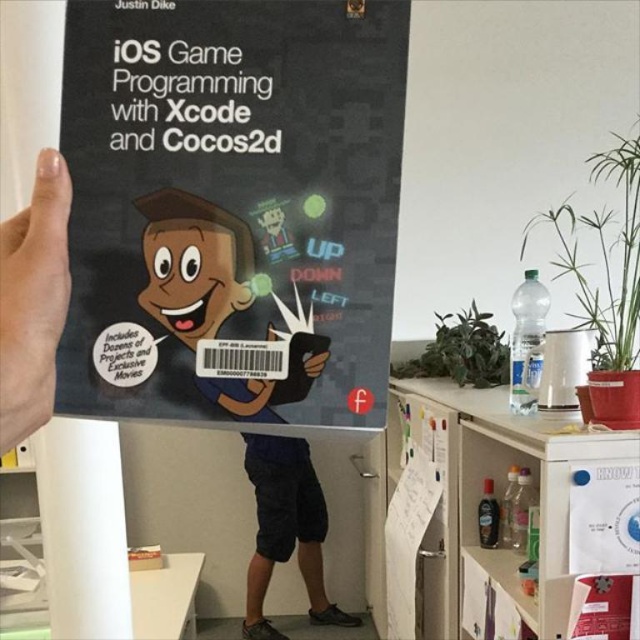
Question: Is the position of matte brown character at center more distant than that of dark blue cotton shorts at lower center?

Choices:
 (A) no
 (B) yes

Answer: (A)

Question: Considering the real-world distances, which object is farthest from the white paper at lower left?

Choices:
 (A) matte brown character at center
 (B) dark blue cotton shorts at lower center

Answer: (B)

Question: Where is matte black book at upper center located in relation to white paper at lower left in the image?

Choices:
 (A) left
 (B) right

Answer: (B)

Question: Which object appears farthest from the camera in this image?

Choices:
 (A) matte black book at upper center
 (B) dark blue cotton shorts at lower center
 (C) smooth skin hand at upper left
 (D) white paper at lower left

Answer: (B)

Question: Which of the following is the farthest from the observer?

Choices:
 (A) matte black book at upper center
 (B) matte brown character at center
 (C) smooth skin hand at upper left

Answer: (B)

Question: Can you confirm if matte black book at upper center is thinner than dark blue cotton shorts at lower center?

Choices:
 (A) yes
 (B) no

Answer: (A)